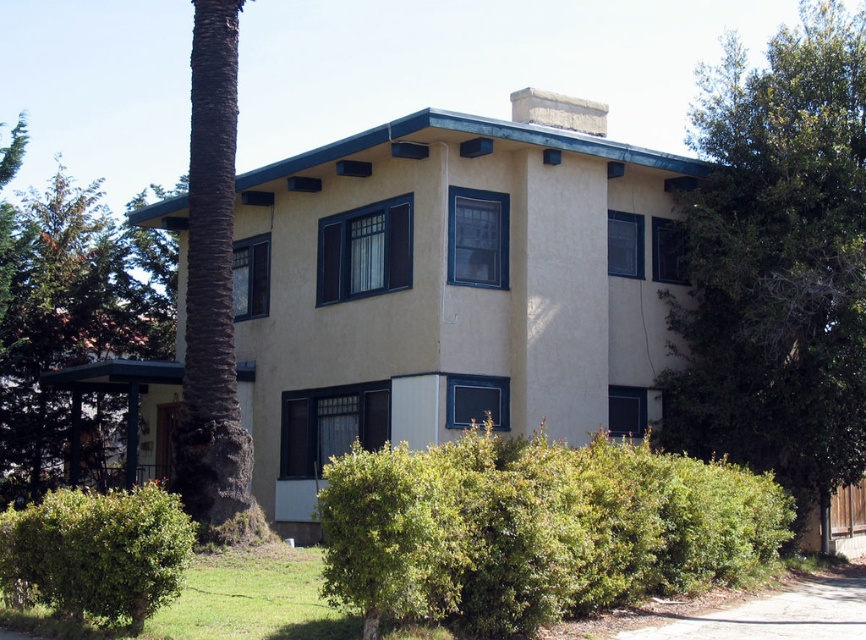
In the scene shown: Is green leafy bush at lower center further to the viewer compared to green leafy tree at left?

No, it is in front of green leafy tree at left.

How distant is green leafy bush at lower center from green leafy tree at left?

green leafy bush at lower center is 32.60 meters away from green leafy tree at left.

The image size is (866, 640). Find the location of `green leafy bush at lower center`. green leafy bush at lower center is located at coordinates (535, 529).

Which is more to the right, green leafy tree at left or green leafy bush at lower left?

green leafy bush at lower left is more to the right.

Which of these two, green leafy tree at left or green leafy bush at lower left, stands shorter?

Standing shorter between the two is green leafy bush at lower left.

Is point (50, 419) closer to camera compared to point (107, 561)?

No, (50, 419) is behind (107, 561).

Locate an element on the screen. green leafy tree at left is located at coordinates (x=73, y=332).

Describe the element at coordinates (779, 262) in the screenshot. I see `green leafy tree at right` at that location.

Between point (771, 429) and point (771, 637), which one is positioned in front?

Point (771, 637)

Identify the location of green leafy tree at right. The image size is (866, 640). tap(779, 262).

Where is `green leafy tree at right`? This screenshot has width=866, height=640. green leafy tree at right is located at coordinates (779, 262).